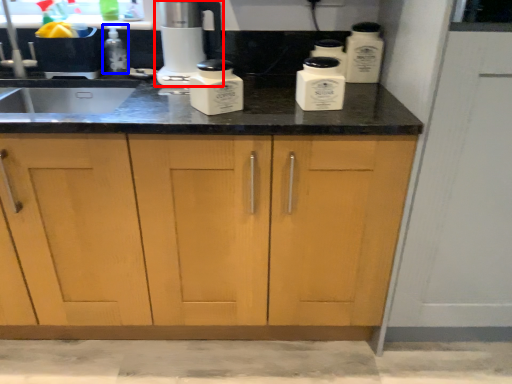
Question: Which object is closer to the camera taking this photo, home appliance (highlighted by a red box) or bottle (highlighted by a blue box)?

Choices:
 (A) home appliance
 (B) bottle

Answer: (A)